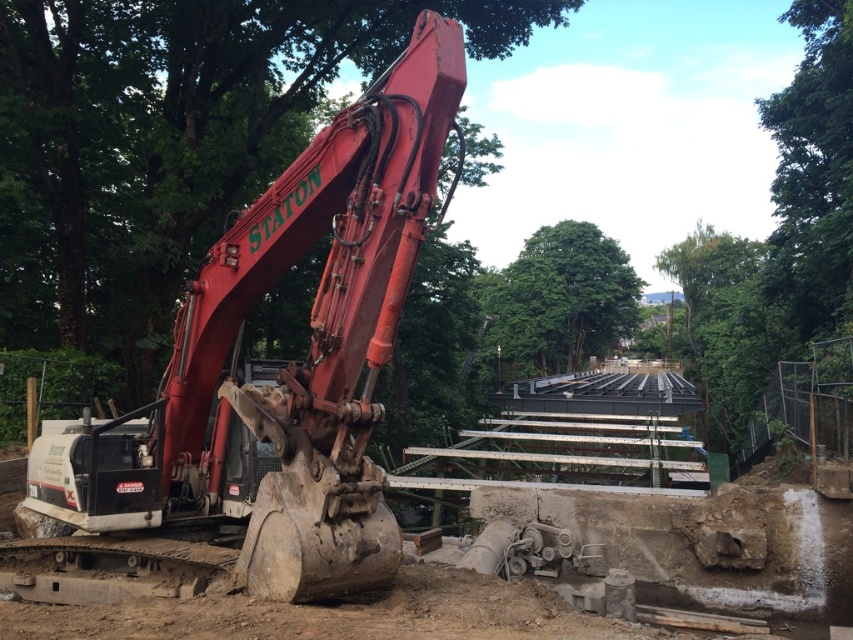
You are a safety inspector standing at the edge of the construction site. You notice the matte red excavator at center and the green leafy tree at center. Based on their positions, which object is closer to the ground?

The matte red excavator at center is below green leafy tree at center, so the matte red excavator at center is closer to the ground.

You are standing at the point labeled point (280, 362) in the image. What object are you directly facing?

The point labeled point (280, 362) marks the location of the matte red excavator at center, so you are directly facing the matte red excavator at center.

You are a safety inspector standing at the edge of the construction site. You need to determine if the matte red excavator at center is shorter than the green leafy tree at center. Based on the scene, what can you conclude?

The matte red excavator at center has a lesser height compared to the green leafy tree at center, so the excavator is shorter than the tree.